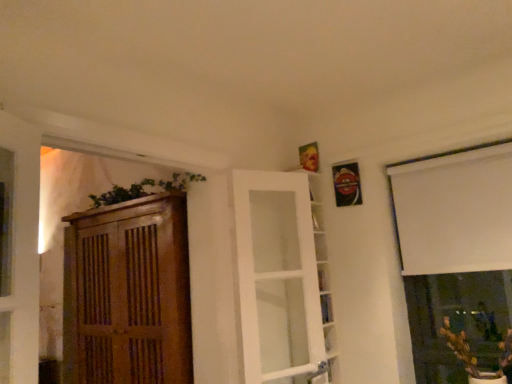
Locate an element on the screen. The image size is (512, 384). white glass door at center is located at coordinates (279, 279).

The image size is (512, 384). What do you see at coordinates (279, 279) in the screenshot? I see `white glass door at center` at bounding box center [279, 279].

Image resolution: width=512 pixels, height=384 pixels. What do you see at coordinates (476, 357) in the screenshot?
I see `green matte plant at lower right` at bounding box center [476, 357].

What do you see at coordinates (174, 182) in the screenshot?
I see `green leafy plant at upper left` at bounding box center [174, 182].

Locate an element on the screen. The height and width of the screenshot is (384, 512). wooden cabinet at left is located at coordinates (128, 293).

Does point (175, 187) appear closer or farther from the camera than point (466, 365)?

Clearly, point (175, 187) is more distant from the camera than point (466, 365).

Which object is wider, green leafy plant at upper left or green matte plant at lower right?

green matte plant at lower right.

Considering the relative sizes of green leafy plant at upper left and green matte plant at lower right in the image provided, is green leafy plant at upper left smaller than green matte plant at lower right?

Yes.

Considering the positions of objects wooden cabinet at left and white glass door at center in the image provided, who is in front, wooden cabinet at left or white glass door at center?

white glass door at center.

Does wooden cabinet at left appear on the left side of white glass door at center?

Correct, you'll find wooden cabinet at left to the left of white glass door at center.

From a real-world perspective, is wooden cabinet at left under white glass door at center?

Indeed, from a real-world perspective, wooden cabinet at left is positioned beneath white glass door at center.

Would you say white glass door at center is part of wooden cabinet at left's contents?

Definitely not — white glass door at center is not inside wooden cabinet at left.

Is green leafy plant at upper left touching wooden cabinet at left?

No, green leafy plant at upper left is not beside wooden cabinet at left.

Would you say wooden cabinet at left is part of green leafy plant at upper left's contents?

No, wooden cabinet at left is not surrounded by green leafy plant at upper left.

From the image's perspective, would you say green leafy plant at upper left is shown under wooden cabinet at left?

No, from the image's perspective, green leafy plant at upper left is not beneath wooden cabinet at left.

From a real-world perspective, which is physically above, green leafy plant at upper left or wooden cabinet at left?

From a 3D spatial view, green leafy plant at upper left is above.

Considering the positions of point (423, 242) and point (495, 372), is point (423, 242) closer or farther from the camera than point (495, 372)?

Point (423, 242) appears to be farther away from the viewer than point (495, 372).

Which is more to the right, white matte window at upper right or green matte plant at lower right?

white matte window at upper right is more to the right.

Is white matte window at upper right in contact with green matte plant at lower right?

They are not placed beside each other.

From the image's perspective, which object appears higher, white matte window at upper right or green matte plant at lower right?

white matte window at upper right is shown above in the image.

Is white matte window at upper right with wooden cabinet at left?

No, white matte window at upper right is not making contact with wooden cabinet at left.

Considering the sizes of objects white matte window at upper right and wooden cabinet at left in the image provided, who is smaller, white matte window at upper right or wooden cabinet at left?

With smaller size is white matte window at upper right.

In the scene shown: From the image's perspective, is white matte window at upper right under wooden cabinet at left?

No, from the image's perspective, white matte window at upper right is not below wooden cabinet at left.

Is green matte plant at lower right positioned with its back to green leafy plant at upper left?

No.

Is green matte plant at lower right far away from green leafy plant at upper left?

Yes, green matte plant at lower right and green leafy plant at upper left are located far from each other.

Which is in front, point (448, 344) or point (190, 177)?

Point (190, 177)

From a real-world perspective, which is physically above, wooden cabinet at left or green matte plant at lower right?

From a 3D spatial view, wooden cabinet at left is above.

Is wooden cabinet at left positioned in front of green matte plant at lower right?

No, wooden cabinet at left is behind green matte plant at lower right.

Considering the relative positions of wooden cabinet at left and green matte plant at lower right in the image provided, is wooden cabinet at left to the left or to the right of green matte plant at lower right?

From the image, it's evident that wooden cabinet at left is to the left of green matte plant at lower right.

Which point is more forward, (86, 299) or (451, 331)?

Point (86, 299)

I want to click on houseplant below the green leafy plant at upper left (from a real-world perspective), so click(x=476, y=357).

Find the location of a particular element. door to the right of wooden cabinet at left is located at coordinates (279, 279).

Looking at the image, which one is located further to wooden cabinet at left, white matte window at upper right or green leafy plant at upper left?

white matte window at upper right is positioned further to the anchor wooden cabinet at left.

Estimate the real-world distances between objects in this image. Which object is closer to white matte window at upper right, green leafy plant at upper left or wooden cabinet at left?

green leafy plant at upper left is closer to white matte window at upper right.

Which object lies nearer to the anchor point green matte plant at lower right, white glass door at center or white matte window at upper right?

Based on the image, white matte window at upper right appears to be nearer to green matte plant at lower right.

When comparing their distances from green matte plant at lower right, does wooden cabinet at left or green leafy plant at upper left seem further?

wooden cabinet at left lies further to green matte plant at lower right than the other object.

Looking at the image, which one is located further to green leafy plant at upper left, white glass door at center or white matte window at upper right?

Among the two, white matte window at upper right is located further to green leafy plant at upper left.

When comparing their distances from white matte window at upper right, does green leafy plant at upper left or green matte plant at lower right seem further?

The object further to white matte window at upper right is green leafy plant at upper left.

Considering their positions, is wooden cabinet at left positioned closer to white matte window at upper right than green leafy plant at upper left?

The object closer to white matte window at upper right is green leafy plant at upper left.

From the image, which object appears to be nearer to green matte plant at lower right, white matte window at upper right or white glass door at center?

white matte window at upper right is closer to green matte plant at lower right.

At what (x,y) coordinates should I click in order to perform the action: click on plant between wooden cabinet at left and white matte window at upper right in the horizontal direction. Please return your answer as a coordinate pair (x, y). Looking at the image, I should click on (174, 182).

I want to click on plant situated between wooden cabinet at left and white glass door at center from left to right, so click(174, 182).

Locate an element on the screen. plant situated between wooden cabinet at left and green matte plant at lower right from left to right is located at coordinates (174, 182).

The height and width of the screenshot is (384, 512). What are the coordinates of `houseplant between green leafy plant at upper left and white matte window at upper right` in the screenshot? It's located at [x=476, y=357].